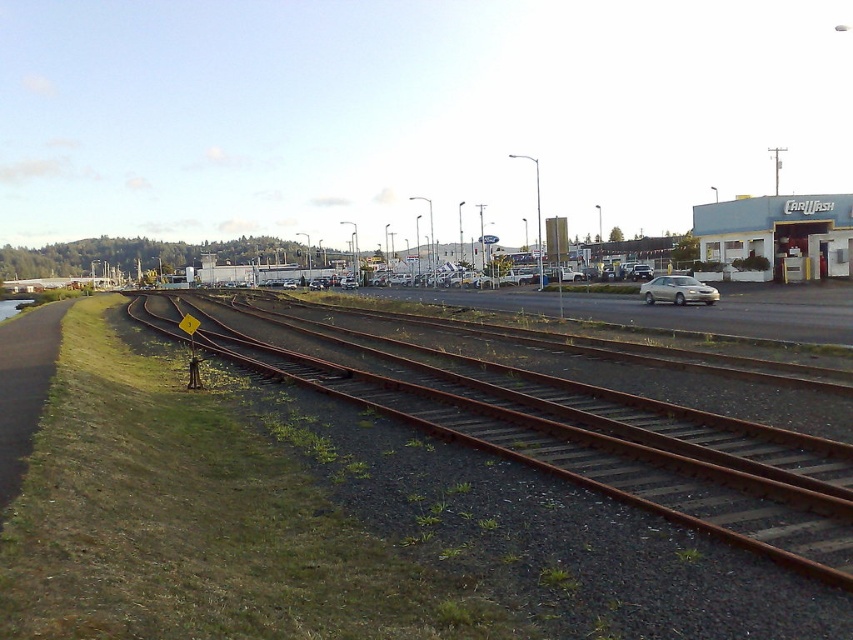
Question: Can you confirm if rusty metal tracks at lower left is positioned above silver metallic sedan at center-right?

Choices:
 (A) no
 (B) yes

Answer: (A)

Question: Does rusty metal tracks at lower left appear over silver metallic sedan at center-right?

Choices:
 (A) yes
 (B) no

Answer: (B)

Question: Among these points, which one is farthest from the camera?

Choices:
 (A) (669, 289)
 (B) (770, 547)

Answer: (A)

Question: Can you confirm if rusty metal tracks at lower left is thinner than silver metallic sedan at center-right?

Choices:
 (A) no
 (B) yes

Answer: (A)